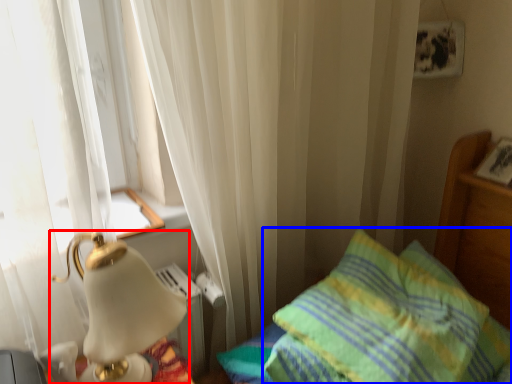
Question: Which object appears closest to the camera in this image, lamp (highlighted by a red box) or pillow (highlighted by a blue box)?

Choices:
 (A) lamp
 (B) pillow

Answer: (A)